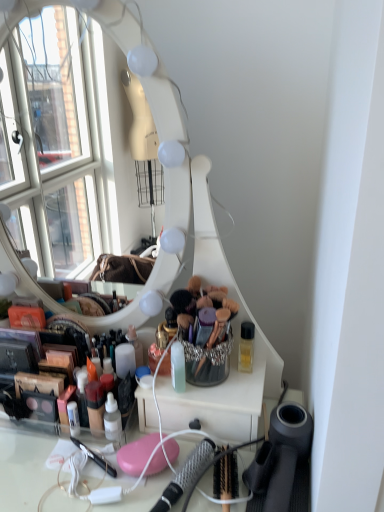
Describe the element at coordinates (36, 351) in the screenshot. This screenshot has height=512, width=384. I see `shiny plastic makeup at center` at that location.

The height and width of the screenshot is (512, 384). I want to click on shiny plastic makeup at center, so click(x=36, y=351).

This screenshot has width=384, height=512. Describe the element at coordinates (185, 475) in the screenshot. I see `metallic silver hairbrush at lower center` at that location.

Identify the location of metallic silver hairbrush at lower center. (185, 475).

Find the location of a particular element. shiny plastic makeup at center is located at coordinates (36, 351).

Which object is positioned more to the right, shiny plastic makeup at center or metallic silver hairbrush at lower center?

metallic silver hairbrush at lower center is more to the right.

Considering their positions, is shiny plastic makeup at center located in front of or behind metallic silver hairbrush at lower center?

Clearly, shiny plastic makeup at center is behind metallic silver hairbrush at lower center.

Does point (55, 348) come closer to viewer compared to point (195, 462)?

No.

From the image's perspective, who appears lower, shiny plastic makeup at center or metallic silver hairbrush at lower center?

From the image's view, metallic silver hairbrush at lower center is below.

Looking at this image, from a real-world perspective, which object stands above the other?

shiny plastic makeup at center, from a real-world perspective.

Can you confirm if shiny plastic makeup at center is thinner than metallic silver hairbrush at lower center?

Yes.

Who is shorter, shiny plastic makeup at center or metallic silver hairbrush at lower center?

With less height is metallic silver hairbrush at lower center.

Who is smaller, shiny plastic makeup at center or metallic silver hairbrush at lower center?

With smaller size is metallic silver hairbrush at lower center.

Would you say shiny plastic makeup at center is outside metallic silver hairbrush at lower center?

shiny plastic makeup at center is positioned outside metallic silver hairbrush at lower center.

Is shiny plastic makeup at center far away from metallic silver hairbrush at lower center?

That's not correct — shiny plastic makeup at center is a little close to metallic silver hairbrush at lower center.

Is shiny plastic makeup at center looking in the opposite direction of metallic silver hairbrush at lower center?

That's not correct — shiny plastic makeup at center is not looking away from metallic silver hairbrush at lower center.

How distant is shiny plastic makeup at center from metallic silver hairbrush at lower center?

shiny plastic makeup at center and metallic silver hairbrush at lower center are 12.54 inches apart from each other.

You are a GUI agent. You are given a task and a screenshot of the screen. Output one action in this format:
    pyautogui.click(x=<x>, y=<y>)
    Task: Click on the toiletry on the left of metallic silver hairbrush at lower center
    The height and width of the screenshot is (512, 384).
    Given the screenshot: What is the action you would take?
    pyautogui.click(x=36, y=351)

Is metallic silver hairbrush at lower center to the left or to the right of shiny plastic makeup at center in the image?

Clearly, metallic silver hairbrush at lower center is on the right of shiny plastic makeup at center in the image.

Is metallic silver hairbrush at lower center positioned in front of shiny plastic makeup at center?

Yes, it is.

Is point (183, 475) positioned before point (33, 348)?

Yes, it is.

From the image's perspective, is metallic silver hairbrush at lower center above or below shiny plastic makeup at center?

Clearly, from the image's perspective, metallic silver hairbrush at lower center is below shiny plastic makeup at center.

From a real-world perspective, is metallic silver hairbrush at lower center below shiny plastic makeup at center?

Correct, in the physical world, metallic silver hairbrush at lower center is lower than shiny plastic makeup at center.

Is metallic silver hairbrush at lower center wider or thinner than shiny plastic makeup at center?

Considering their sizes, metallic silver hairbrush at lower center looks broader than shiny plastic makeup at center.

Does metallic silver hairbrush at lower center have a lesser height compared to shiny plastic makeup at center?

Yes, metallic silver hairbrush at lower center is shorter than shiny plastic makeup at center.

Considering the sizes of objects metallic silver hairbrush at lower center and shiny plastic makeup at center in the image provided, who is smaller, metallic silver hairbrush at lower center or shiny plastic makeup at center?

metallic silver hairbrush at lower center.

Would you say metallic silver hairbrush at lower center contains shiny plastic makeup at center?

That's incorrect, shiny plastic makeup at center is not inside metallic silver hairbrush at lower center.

Are metallic silver hairbrush at lower center and shiny plastic makeup at center far apart?

No.

Is metallic silver hairbrush at lower center facing away from shiny plastic makeup at center?

No.

Can you tell me how much metallic silver hairbrush at lower center and shiny plastic makeup at center differ in facing direction?

22 degrees separate the facing orientations of metallic silver hairbrush at lower center and shiny plastic makeup at center.

Locate an element on the screen. This screenshot has width=384, height=512. brush below the shiny plastic makeup at center (from the image's perspective) is located at coordinates (185, 475).

The height and width of the screenshot is (512, 384). In order to click on toiletry behind the metallic silver hairbrush at lower center in this screenshot , I will do `click(36, 351)`.

You are a GUI agent. You are given a task and a screenshot of the screen. Output one action in this format:
    pyautogui.click(x=<x>, y=<y>)
    Task: Click on the toiletry above the metallic silver hairbrush at lower center (from a real-world perspective)
    This screenshot has width=384, height=512.
    Given the screenshot: What is the action you would take?
    pyautogui.click(x=36, y=351)